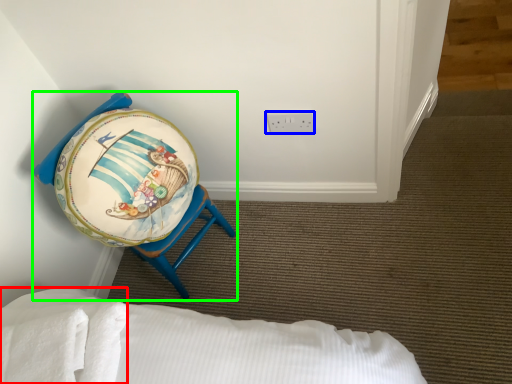
Question: Which object is positioned farthest from sheet (highlighted by a red box)? Select from electric outlet (highlighted by a blue box) and furniture (highlighted by a green box).

Choices:
 (A) electric outlet
 (B) furniture

Answer: (A)